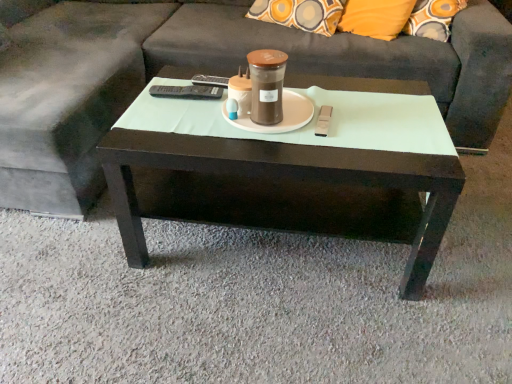
Where is `free space to the right of white matte saucer at center`? free space to the right of white matte saucer at center is located at coordinates (356, 115).